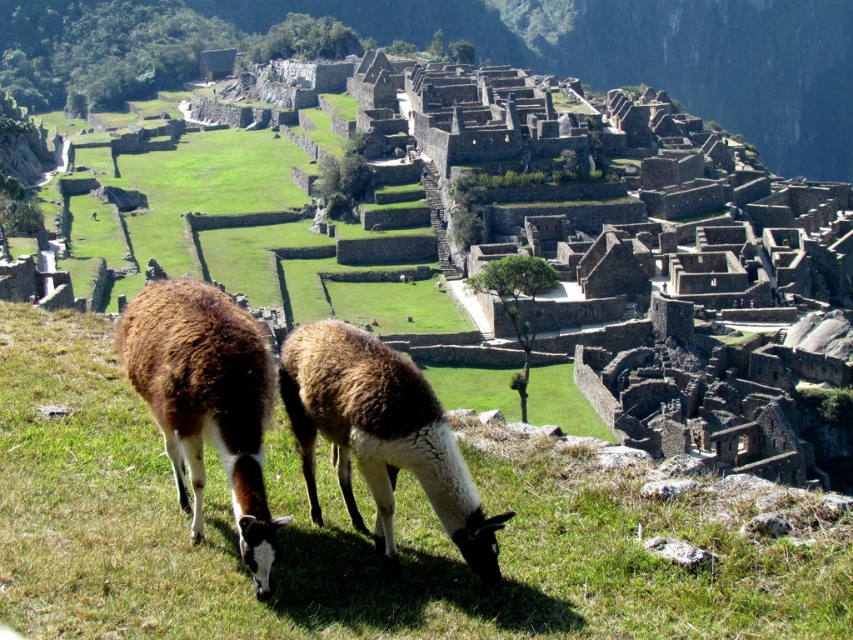
You are standing at the lower left corner of the image and want to walk towards the green grass at center. Which direction should you move relative to the brown woolly alpaca at lower left?

You should move to the right relative to the brown woolly alpaca at lower left because the green grass at center is located to the right of the brown woolly alpaca at lower left.